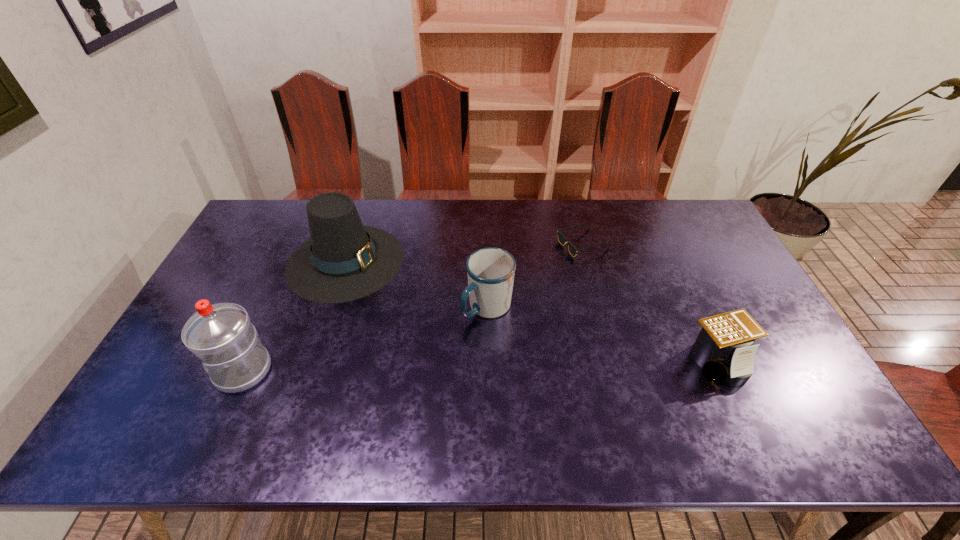
In the image, there is a desktop. Find the location of `vacant space at the right edge`. vacant space at the right edge is located at coordinates (701, 287).

In the image, there is a desktop. At what (x,y) coordinates should I click in order to perform the action: click on vacant space at the far right corner. Please return your answer as a coordinate pair (x, y). The image size is (960, 540). Looking at the image, I should click on (681, 219).

The width and height of the screenshot is (960, 540). Identify the location of vacant space that is in between the fourth tallest object and the water bottle. (480, 366).

The width and height of the screenshot is (960, 540). I want to click on unoccupied area between the mug and the shortest object, so click(x=535, y=276).

Find the location of a particular element. vacant region between the sunglasses and the hat is located at coordinates (464, 253).

This screenshot has width=960, height=540. I want to click on free space between the water bottle and the hat, so click(294, 315).

The height and width of the screenshot is (540, 960). Find the location of `free space between the water bottle and the sunglasses`. free space between the water bottle and the sunglasses is located at coordinates (413, 307).

Where is `free spot between the third shortest object and the water bottle`? free spot between the third shortest object and the water bottle is located at coordinates pos(366,339).

Identify the location of vacant area that lies between the hat and the water bottle. (294, 315).

Locate an element on the screen. The width and height of the screenshot is (960, 540). free point between the sunglasses and the rightmost object is located at coordinates (650, 303).